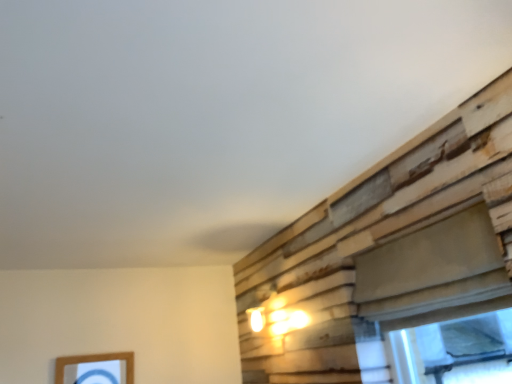
Question: Relative to wooden picture frame at lower left, is smooth beige window at right in front or behind?

Choices:
 (A) behind
 (B) front

Answer: (B)

Question: In terms of width, does smooth beige window at right look wider or thinner when compared to wooden picture frame at lower left?

Choices:
 (A) wide
 (B) thin

Answer: (A)

Question: From the image's perspective, relative to wooden picture frame at lower left, is smooth beige window at right above or below?

Choices:
 (A) below
 (B) above

Answer: (B)

Question: Looking at the image, does wooden picture frame at lower left seem bigger or smaller compared to smooth beige window at right?

Choices:
 (A) small
 (B) big

Answer: (A)

Question: Considering the relative positions of wooden picture frame at lower left and smooth beige window at right in the image provided, is wooden picture frame at lower left to the left or to the right of smooth beige window at right?

Choices:
 (A) left
 (B) right

Answer: (A)

Question: Is wooden picture frame at lower left taller or shorter than smooth beige window at right?

Choices:
 (A) tall
 (B) short

Answer: (B)

Question: Considering the positions of point (76, 362) and point (455, 279), is point (76, 362) closer or farther from the camera than point (455, 279)?

Choices:
 (A) farther
 (B) closer

Answer: (A)